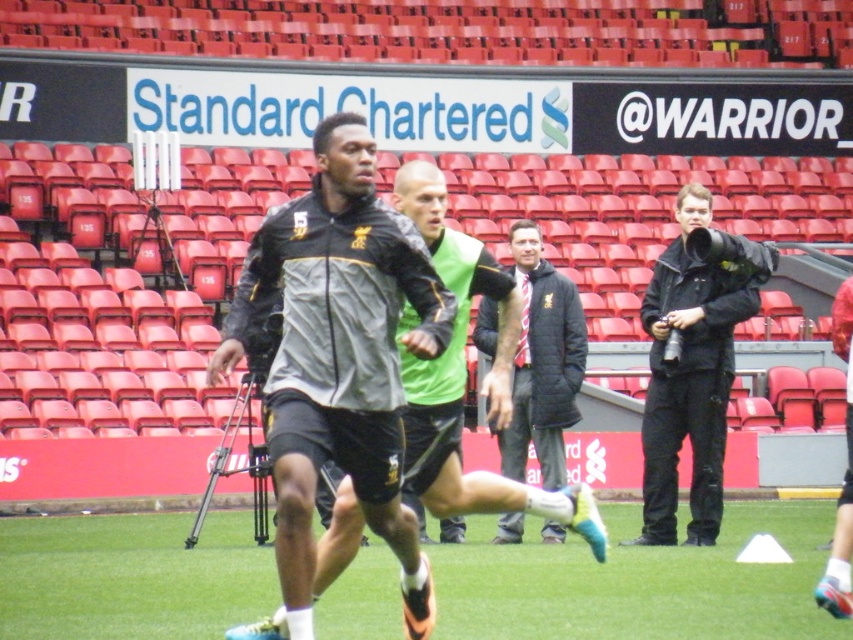
Question: Which of the following is the farthest from the observer?

Choices:
 (A) dark gray jacket at center
 (B) green grass at center
 (C) green matte vest at center
 (D) black leather jacket at right

Answer: (A)

Question: Which of the following is the closest to the observer?

Choices:
 (A) black leather jacket at right
 (B) green grass at center
 (C) dark gray jacket at center
 (D) green matte vest at center

Answer: (B)

Question: Among these points, which one is nearest to the camera?

Choices:
 (A) (659, 326)
 (B) (805, 564)
 (C) (407, 611)
 (D) (561, 301)

Answer: (C)

Question: Is green grass at center further to camera compared to dark gray jacket at center?

Choices:
 (A) yes
 (B) no

Answer: (B)

Question: Does green grass at center appear on the left side of black leather jacket at right?

Choices:
 (A) yes
 (B) no

Answer: (A)

Question: Does green grass at center have a larger size compared to dark gray jacket at center?

Choices:
 (A) yes
 (B) no

Answer: (A)